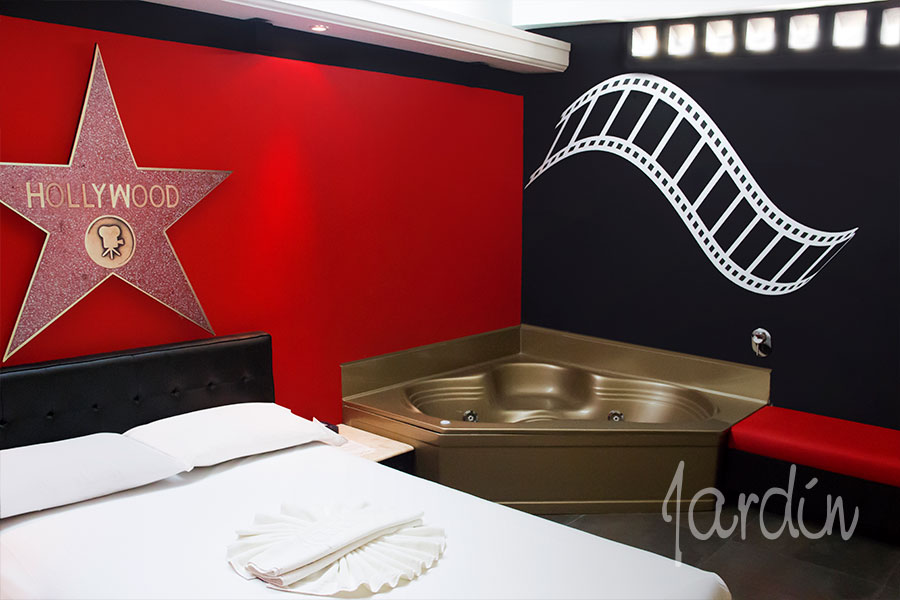
You are a GUI agent. You are given a task and a screenshot of the screen. Output one action in this format:
    pyautogui.click(x=<x>, y=<y>)
    Task: Click on the bed
    
    Given the screenshot: What is the action you would take?
    pyautogui.click(x=176, y=541)